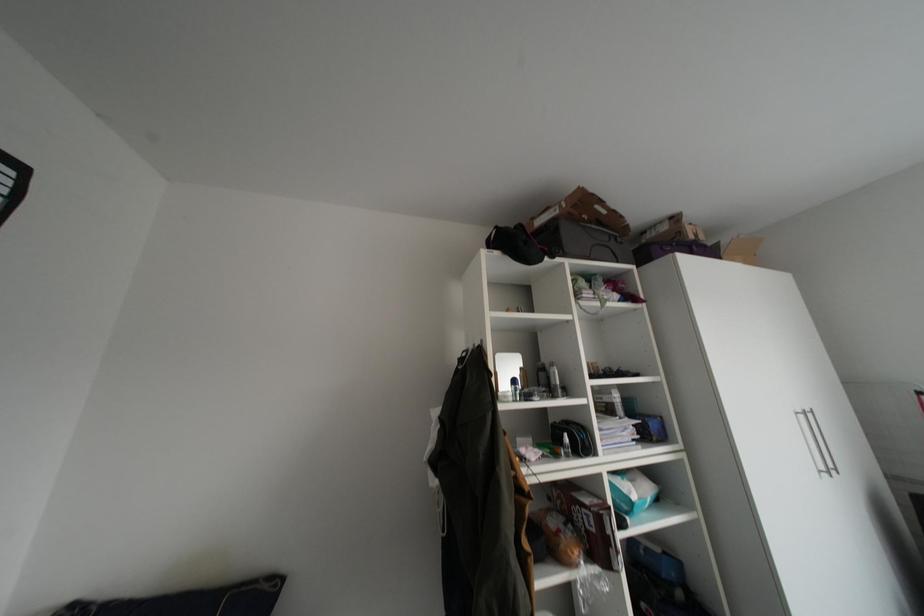
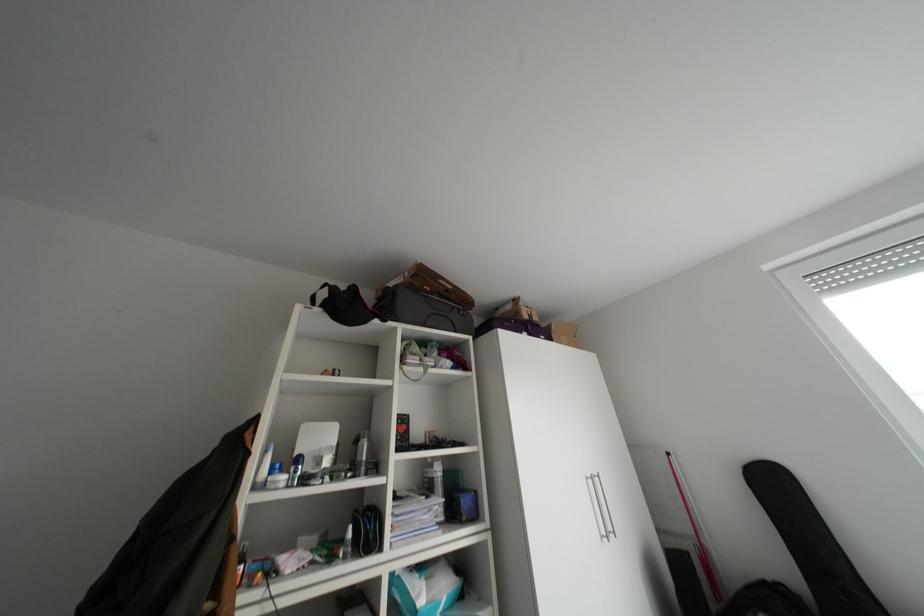
Question: The images are taken continuously from a first-person perspective. In which direction are you moving?

Choices:
 (A) Left
 (B) Right
 (C) Forward
 (D) Backward

Answer: (B)